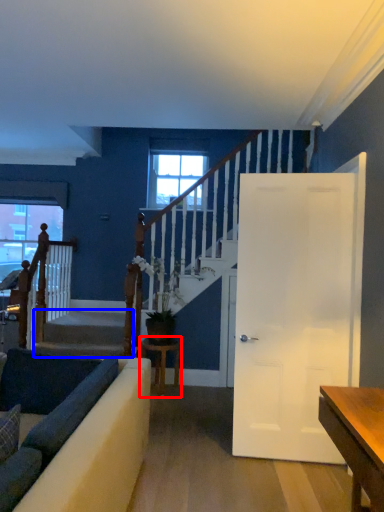
Question: Among these objects, which one is farthest to the camera, table (highlighted by a red box) or stairwell (highlighted by a blue box)?

Choices:
 (A) table
 (B) stairwell

Answer: (B)